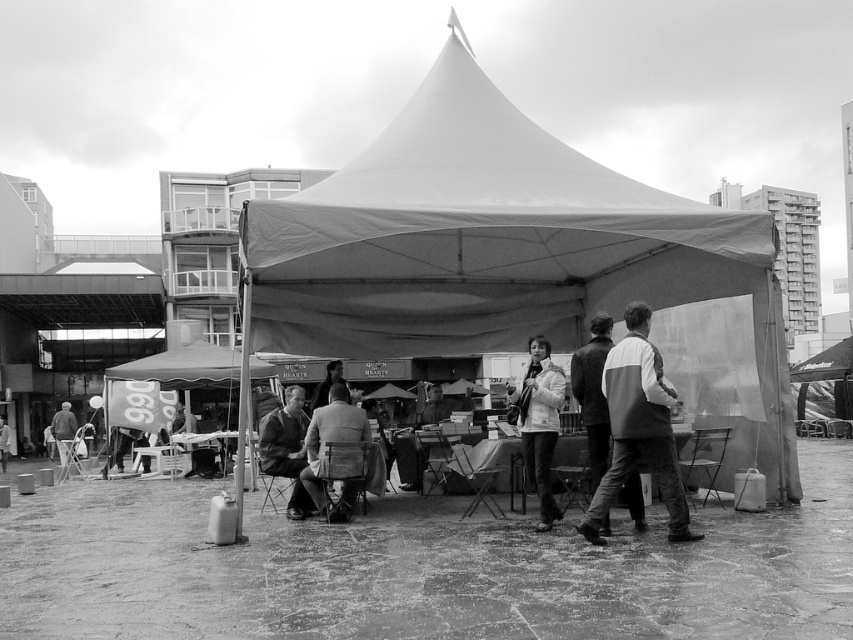
Which is in front, point (321, 497) or point (326, 372)?

Point (321, 497) is in front.

Does matte gray suit at center have a larger size compared to smooth leather jacket at center?

Incorrect, matte gray suit at center is not larger than smooth leather jacket at center.

The width and height of the screenshot is (853, 640). Identify the location of matte gray suit at center. click(x=329, y=442).

Does point (405, 228) lie behind point (322, 394)?

No, it is not.

Is white fabric tent at center to the right of smooth leather jacket at center from the viewer's perspective?

Yes, white fabric tent at center is to the right of smooth leather jacket at center.

Who is more distant from viewer, (434, 61) or (315, 401)?

Point (434, 61)

Locate an element on the screen. This screenshot has height=640, width=853. white fabric tent at center is located at coordinates (494, 246).

From the picture: Between white fabric tent at center and white fabric jacket at center, which one appears on the left side from the viewer's perspective?

Positioned to the left is white fabric tent at center.

Is white fabric tent at center closer to camera compared to white fabric jacket at center?

No, it is behind white fabric jacket at center.

Which is in front, point (706, 269) or point (633, 346)?

Point (633, 346) is more forward.

At what (x,y) coordinates should I click in order to perform the action: click on white fabric tent at center. Please return your answer as a coordinate pair (x, y). Image resolution: width=853 pixels, height=640 pixels. Looking at the image, I should click on point(494,246).